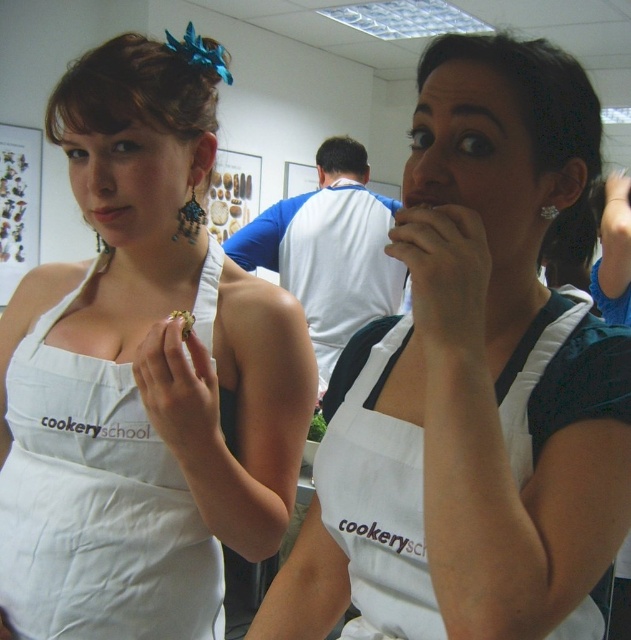
Looking at this image, is matte black mouth at center bigger than gold metallic ring at upper center?

Correct, matte black mouth at center is larger in size than gold metallic ring at upper center.

Between point (404, 196) and point (546, 216), which one is positioned in front?

Point (404, 196) is in front.

Identify the location of matte black mouth at center. The image size is (631, 640). (420, 198).

Can you confirm if white apron at center is smaller than white cotton apron at center?

No.

The width and height of the screenshot is (631, 640). Describe the element at coordinates (473, 385) in the screenshot. I see `white apron at center` at that location.

Between point (475, 600) and point (432, 636), which one is positioned behind?

Point (432, 636)

This screenshot has width=631, height=640. In order to click on white apron at center in this screenshot , I will do `click(473, 385)`.

Is matte white apron at center smaller than white cotton apron at left?

Incorrect, matte white apron at center is not smaller in size than white cotton apron at left.

Who is more distant from viewer, [208,163] or [62,630]?

The point [208,163] is more distant.

This screenshot has height=640, width=631. I want to click on matte white apron at center, so (143, 374).